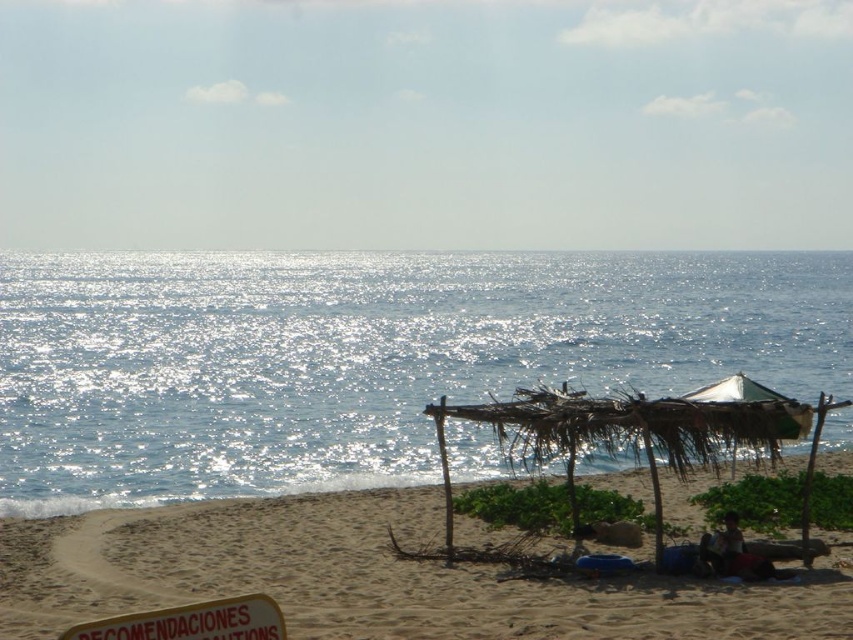
You are standing at a point on the beach and want to reach the shelter. The coordinates of the shelter are point (4, 348). There is an obstacle at point (107, 625). Can you walk directly to the shelter without going around the obstacle?

Point (4, 348) is behind point (107, 625), so the obstacle at point (107, 625) is between you and the shelter. You will need to go around the obstacle to reach the shelter.

Based on the photo, you are standing on the beach and want to reach the point marked as point (229, 612). If you walk directly towards it, how far will you have to walk?

The point (229, 612) is 8.95 meters away from the viewer, so you will have to walk 8.95 meters to reach it.